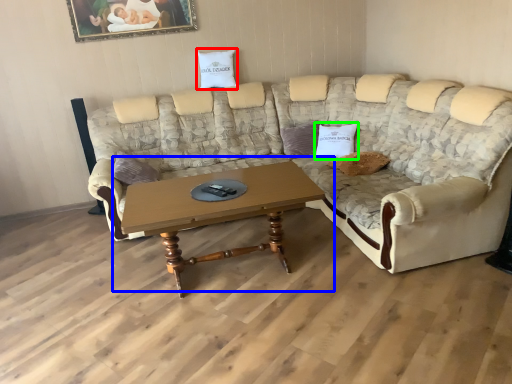
Question: Which object is the closest to the pillow (highlighted by a red box)? Choose among these: coffee table (highlighted by a blue box) or pillow (highlighted by a green box).

Choices:
 (A) coffee table
 (B) pillow

Answer: (B)